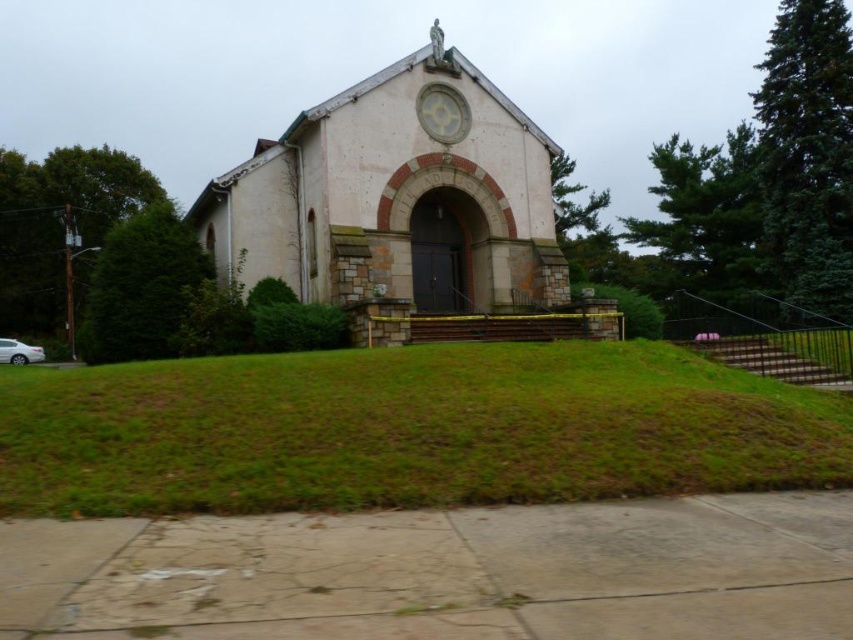
Question: Considering the relative positions of green grass at center and white glossy sedan at lower left in the image provided, where is green grass at center located with respect to white glossy sedan at lower left?

Choices:
 (A) right
 (B) left

Answer: (A)

Question: Estimate the real-world distances between objects in this image. Which object is farther from the white glossy sedan at lower left?

Choices:
 (A) green grass at center
 (B) white stone church at center

Answer: (A)

Question: Does green grass at center have a lesser width compared to white glossy sedan at lower left?

Choices:
 (A) no
 (B) yes

Answer: (A)

Question: Does green grass at center come behind white stone church at center?

Choices:
 (A) no
 (B) yes

Answer: (A)

Question: Among these points, which one is nearest to the camera?

Choices:
 (A) (236, 177)
 (B) (36, 348)
 (C) (335, 368)

Answer: (C)

Question: Which of the following is the farthest from the observer?

Choices:
 (A) white glossy sedan at lower left
 (B) white stone church at center

Answer: (A)